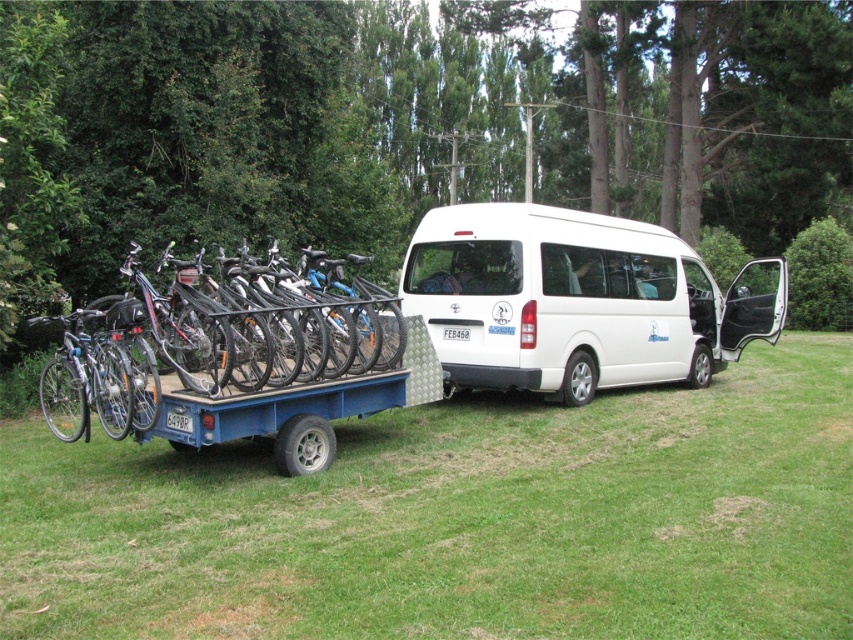
You are planning to set up a picnic blanket in the green grass at lower center. Considering the size of the shiny metallic bicycle at left, will there be enough space to place a standard picnic blanket that is 2 meters by 2 meters?

The green grass at lower center has a larger size compared to the shiny metallic bicycle at left. Since the grass area is bigger than the bicycle, there should be sufficient space to place a standard 2m by 2m picnic blanket.